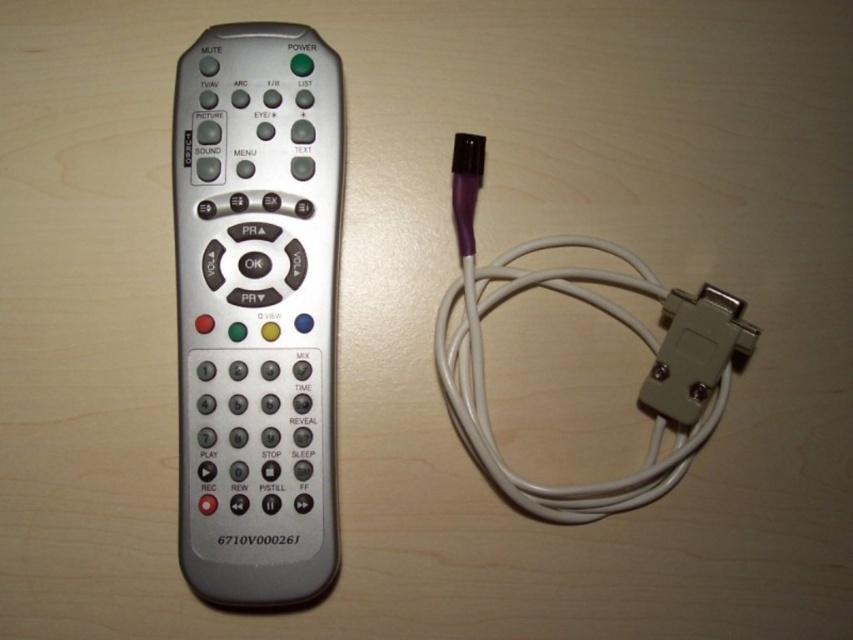
Which is above, silver metallic remote at left or white rubber cable at right?

silver metallic remote at left is above.

Is point (308, 177) in front of point (465, 346)?

Yes, it is in front of point (465, 346).

Where is `silver metallic remote at left`? The height and width of the screenshot is (640, 853). silver metallic remote at left is located at coordinates 257,310.